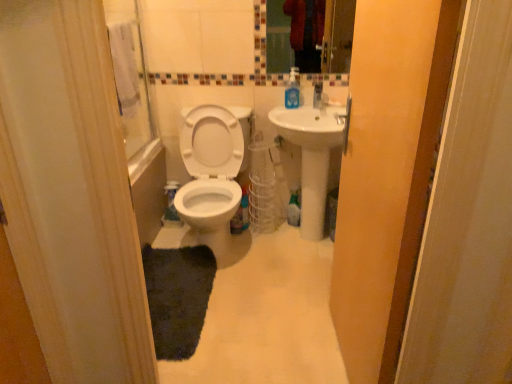
Question: Can you confirm if white ceramic sink at center is wider than matte glass mirror at upper center?

Choices:
 (A) yes
 (B) no

Answer: (A)

Question: Is white ceramic sink at center located outside matte glass mirror at upper center?

Choices:
 (A) no
 (B) yes

Answer: (B)

Question: Is white ceramic sink at center placed right next to matte glass mirror at upper center?

Choices:
 (A) no
 (B) yes

Answer: (A)

Question: From a real-world perspective, does white ceramic sink at center sit lower than matte glass mirror at upper center?

Choices:
 (A) yes
 (B) no

Answer: (A)

Question: Does white ceramic sink at center have a smaller size compared to matte glass mirror at upper center?

Choices:
 (A) yes
 (B) no

Answer: (B)

Question: Is blue translucent soap dispenser at upper right inside the boundaries of matte glass mirror at upper center, or outside?

Choices:
 (A) outside
 (B) inside

Answer: (A)

Question: Considering the relative positions of blue translucent soap dispenser at upper right and matte glass mirror at upper center in the image provided, is blue translucent soap dispenser at upper right to the left or to the right of matte glass mirror at upper center?

Choices:
 (A) right
 (B) left

Answer: (B)

Question: From the image's perspective, is blue translucent soap dispenser at upper right positioned above or below matte glass mirror at upper center?

Choices:
 (A) above
 (B) below

Answer: (B)

Question: Considering the positions of point (295, 77) and point (338, 36), is point (295, 77) closer or farther from the camera than point (338, 36)?

Choices:
 (A) closer
 (B) farther

Answer: (A)

Question: In the image, is white ceramic sink at center positioned in front of or behind transparent plastic screen door at upper center?

Choices:
 (A) behind
 (B) front

Answer: (A)

Question: From their relative heights in the image, would you say white ceramic sink at center is taller or shorter than transparent plastic screen door at upper center?

Choices:
 (A) short
 (B) tall

Answer: (A)

Question: Considering the positions of point (325, 165) and point (373, 112), is point (325, 165) closer or farther from the camera than point (373, 112)?

Choices:
 (A) farther
 (B) closer

Answer: (A)

Question: Looking at the image, does white ceramic sink at center seem bigger or smaller compared to transparent plastic screen door at upper center?

Choices:
 (A) big
 (B) small

Answer: (A)

Question: From the image's perspective, is matte glass mirror at upper center located above or below white glossy toilet at center?

Choices:
 (A) below
 (B) above

Answer: (B)

Question: In terms of height, does matte glass mirror at upper center look taller or shorter compared to white glossy toilet at center?

Choices:
 (A) short
 (B) tall

Answer: (A)